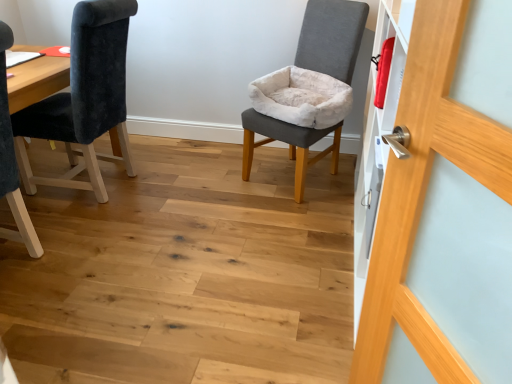
The image size is (512, 384). Identify the location of unoccupied space behind velvet dark blue chair at left, which is the 1th chair in left-to-right order. (155, 150).